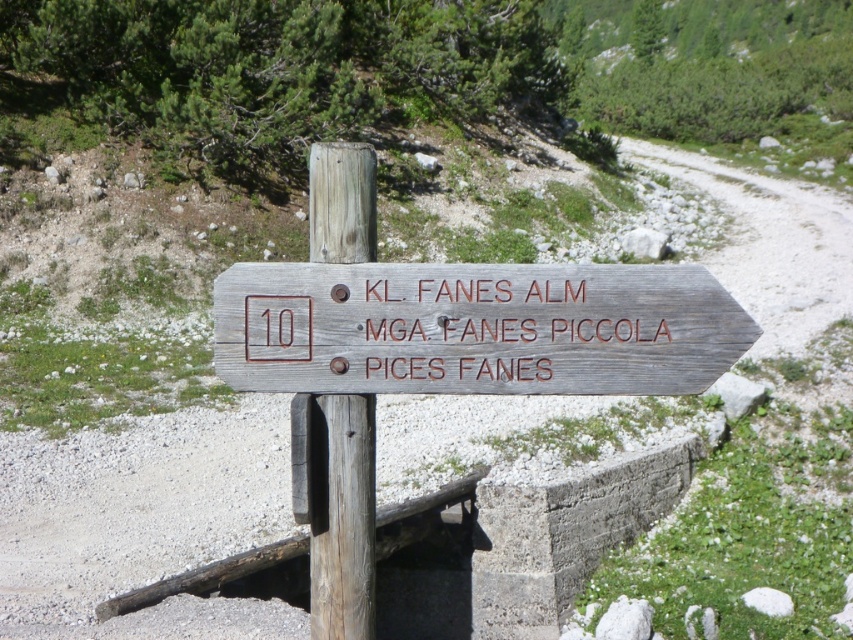
You are a hiker trying to read the directional signs on the weathered wood sign at center and the weathered wood signpost at center. Which object has a greater width?

The weathered wood sign at center has a greater width than the weathered wood signpost at center.

In the scene shown: You are a hiker trying to read the directional signs on the weathered wood sign at center and the weathered wood signpost at center. Which one do you think you can read more easily from a distance?

The weathered wood sign at center is larger in size than the weathered wood signpost at center, so it can be read more easily from a distance.

You are standing in front of a wooden signpost in a forest. You notice two objects labeled as the weathered wood sign at center and the weathered wood signpost at center. Which one is shorter in height?

The weathered wood sign at center is shorter in height compared to the weathered wood signpost at center.